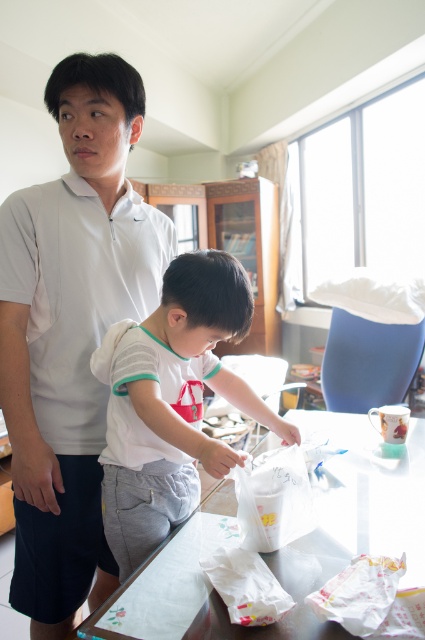
Can you confirm if white matte shirt at upper left is positioned above transparent plastic table at center?

Correct, white matte shirt at upper left is located above transparent plastic table at center.

What do you see at coordinates (71, 333) in the screenshot? I see `white matte shirt at upper left` at bounding box center [71, 333].

What do you see at coordinates (71, 333) in the screenshot? Image resolution: width=425 pixels, height=640 pixels. I see `white matte shirt at upper left` at bounding box center [71, 333].

In order to click on white matte shirt at upper left in this screenshot , I will do `click(71, 333)`.

Which is below, white matte shirt at upper left or white cotton shirt at center?

white cotton shirt at center is below.

Is point (70, 132) positioned in front of point (294, 429)?

Yes.

Is point (129, 304) positioned in front of point (144, 476)?

No.

Locate an element on the screen. The width and height of the screenshot is (425, 640). white matte shirt at upper left is located at coordinates (71, 333).

Does white cotton shirt at center lie in front of transparent plastic table at center?

No.

The image size is (425, 640). Describe the element at coordinates (172, 401) in the screenshot. I see `white cotton shirt at center` at that location.

Image resolution: width=425 pixels, height=640 pixels. In order to click on white cotton shirt at center in this screenshot , I will do `click(172, 401)`.